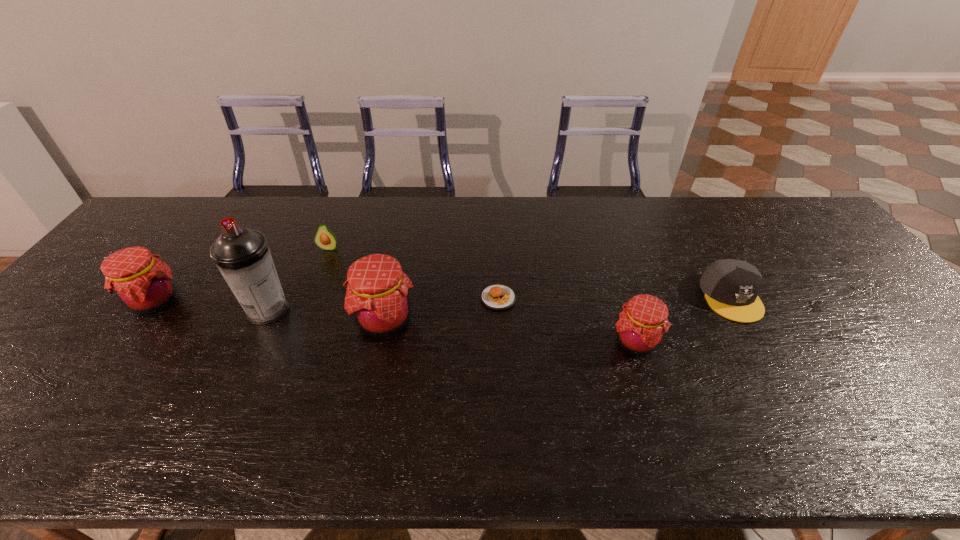
In the current image, all jams are evenly spaced. To maintain this equal spacing, where should an additional jam be placed on the right? Please point out a free spot. Please provide its 2D coordinates. Your answer should be formatted as a tuple, i.e. [(x, y)], where the tuple contains the x and y coordinates of a point satisfying the conditions above.

[(912, 365)]